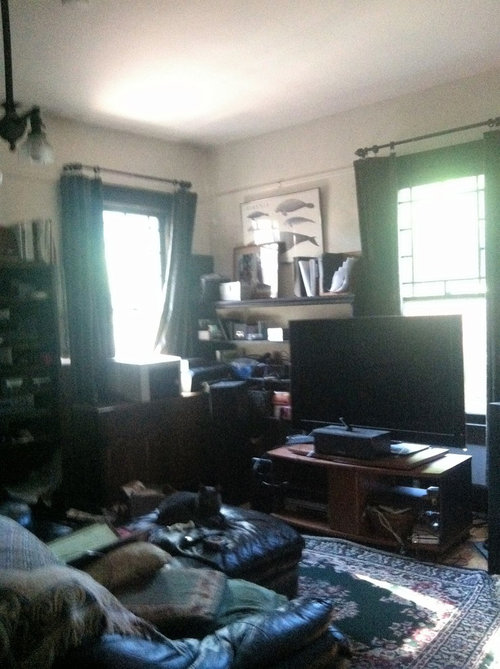
Find the location of `black leather ottomman`. black leather ottomman is located at coordinates (274, 554).